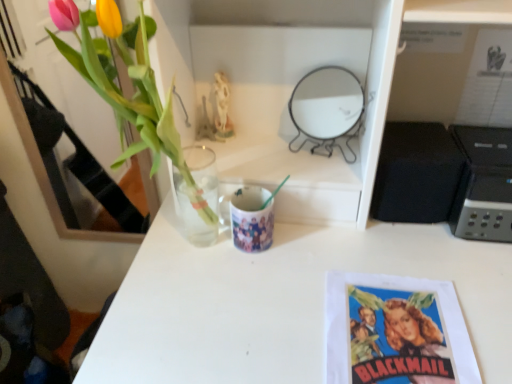
Question: Considering the positions of black matte speaker at right and translucent glass vase at upper left in the image, is black matte speaker at right taller or shorter than translucent glass vase at upper left?

Choices:
 (A) short
 (B) tall

Answer: (A)

Question: From the image's perspective, is black matte speaker at right located above or below translucent glass vase at upper left?

Choices:
 (A) above
 (B) below

Answer: (B)

Question: Estimate the real-world distances between objects in this image. Which object is closer to the black matte speaker at right?

Choices:
 (A) matte ceramic mug at center
 (B) metallic round mirror at upper center
 (C) printed paper poster at lower right
 (D) translucent glass vase at upper left
 (E) black plastic printer at right

Answer: (E)

Question: Considering the real-world distances, which object is farthest from the metallic round mirror at upper center?

Choices:
 (A) black matte speaker at right
 (B) matte ceramic mug at center
 (C) black plastic printer at right
 (D) translucent glass vase at upper left
 (E) printed paper poster at lower right

Answer: (E)